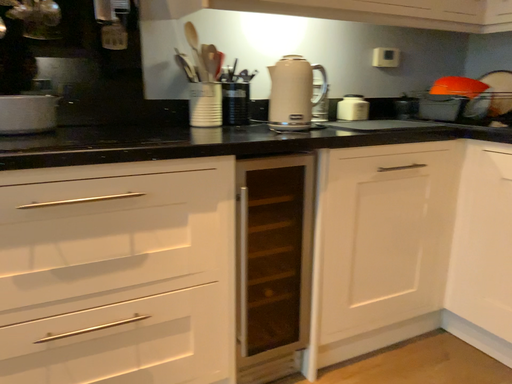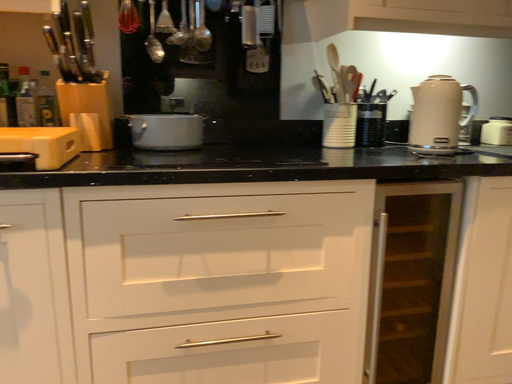
Question: Which way did the camera rotate in the video?

Choices:
 (A) rotated right
 (B) rotated left

Answer: (B)